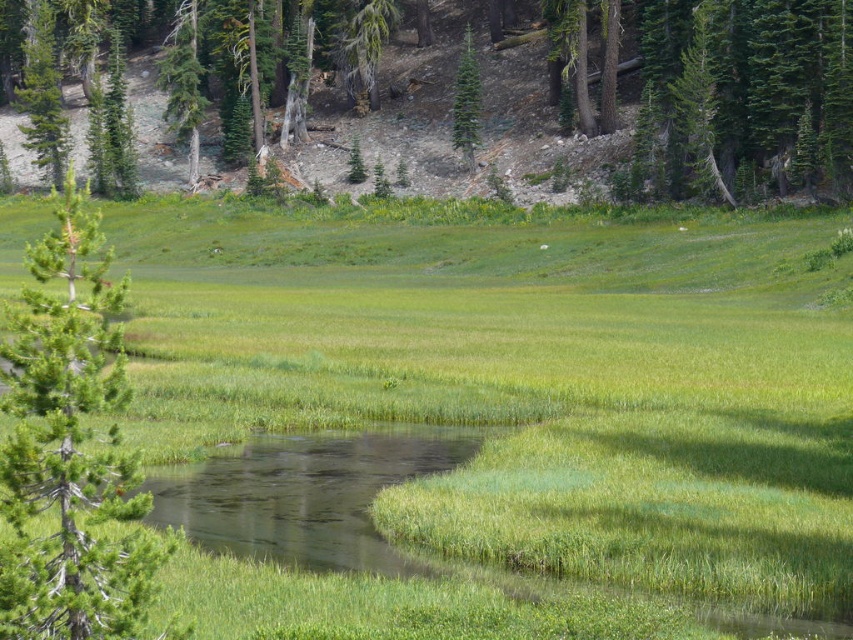
Question: Which object appears farthest from the camera in this image?

Choices:
 (A) green textured pine tree at center
 (B) green leafy tree at upper center
 (C) green textured pine tree at left

Answer: (A)

Question: Which object appears closest to the camera in this image?

Choices:
 (A) green textured pine tree at left
 (B) green leafy tree at upper center
 (C) green textured pine tree at center
 (D) green grassy at center

Answer: (A)

Question: Can you confirm if green textured pine tree at left is positioned to the left of green textured pine tree at center?

Choices:
 (A) yes
 (B) no

Answer: (A)

Question: Does green textured pine tree at left appear on the left side of green textured pine tree at center?

Choices:
 (A) yes
 (B) no

Answer: (A)

Question: Which object appears closest to the camera in this image?

Choices:
 (A) green grassy at center
 (B) green leafy tree at upper center

Answer: (A)

Question: From the image, what is the correct spatial relationship of green grassy at center in relation to green textured pine tree at left?

Choices:
 (A) right
 (B) left

Answer: (A)